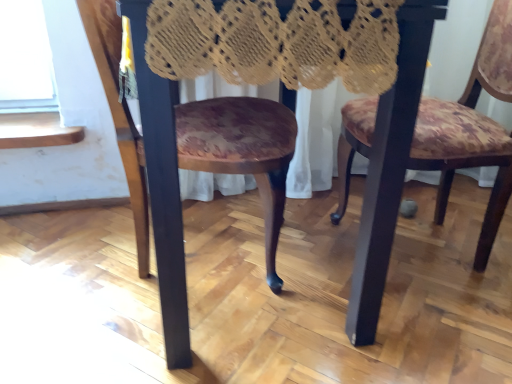
You are a GUI agent. You are given a task and a screenshot of the screen. Output one action in this format:
    pyautogui.click(x=<x>, y=<y>)
    Task: Click on the free area below floral fabric chair at center, marked as the second chair in a left-to-right arrangement (from a real-world perspective)
    
    Given the screenshot: What is the action you would take?
    pyautogui.click(x=423, y=248)